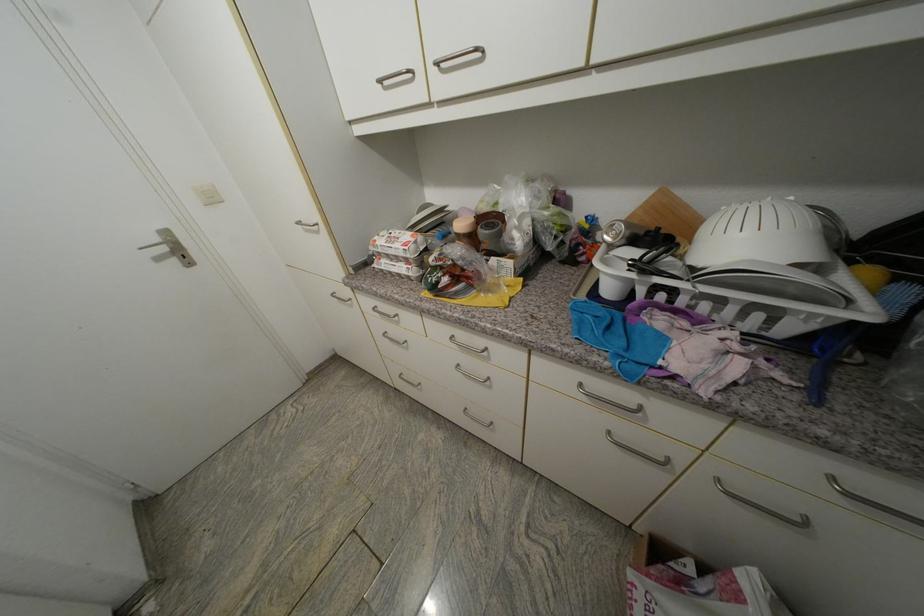
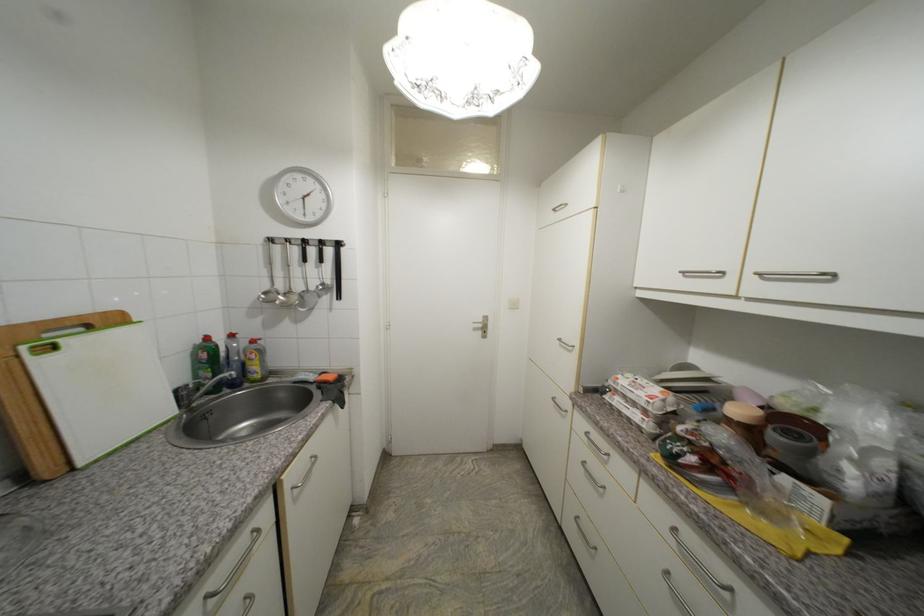
In the second image, find the point that corresponds to point 382,315 in the first image.

(590, 440)